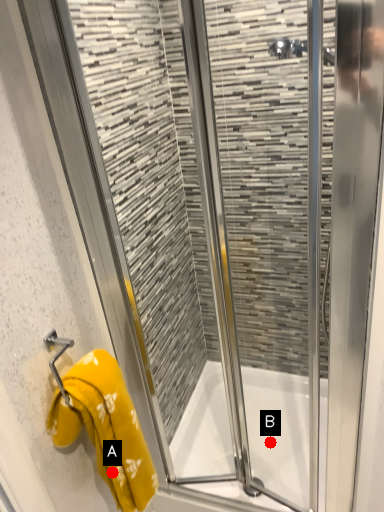
Question: Two points are circled on the image, labeled by A and B beside each circle. Which point is closer to the camera?

Choices:
 (A) A is closer
 (B) B is closer

Answer: (A)